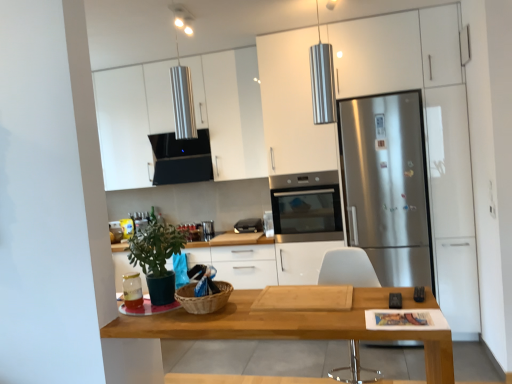
Find the location of a particular element. empty space that is to the right of matte glass jar at lower left, placed as the second appliance when sorted from front to back is located at coordinates (164, 306).